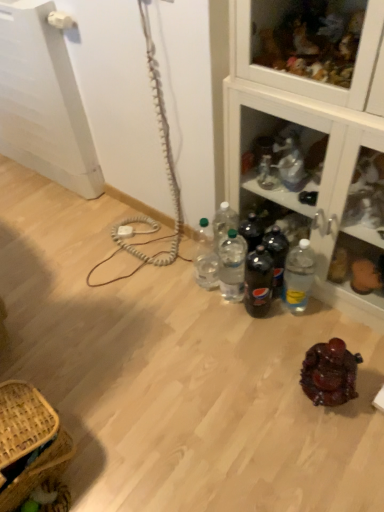
Locate an element on the screen. This screenshot has height=512, width=384. vacant area that lies in front of clear plastic bottle at lower right, which appears as the 1th bottle when viewed from the right is located at coordinates (301, 338).